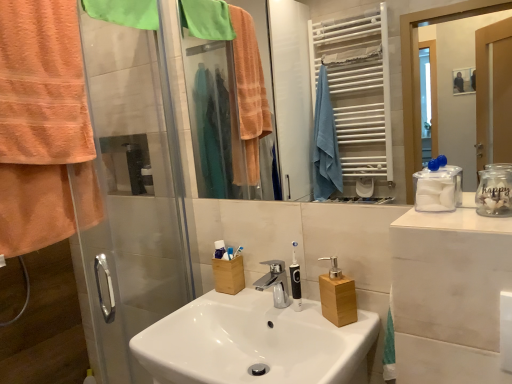
The image size is (512, 384). I want to click on vacant space positioned to the left of clear glass jar at right, placed as the first bottle when sorted from top to bottom, so click(x=450, y=217).